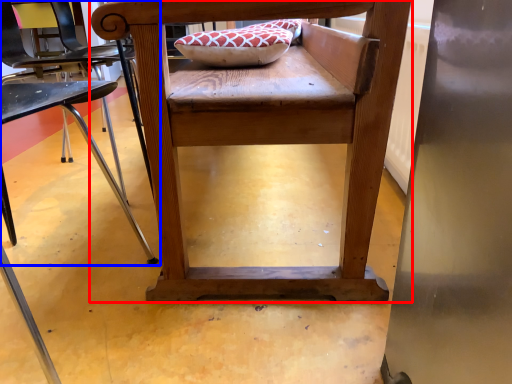
Question: Which object is further to the camera taking this photo, chair (highlighted by a red box) or chair (highlighted by a blue box)?

Choices:
 (A) chair
 (B) chair

Answer: (A)